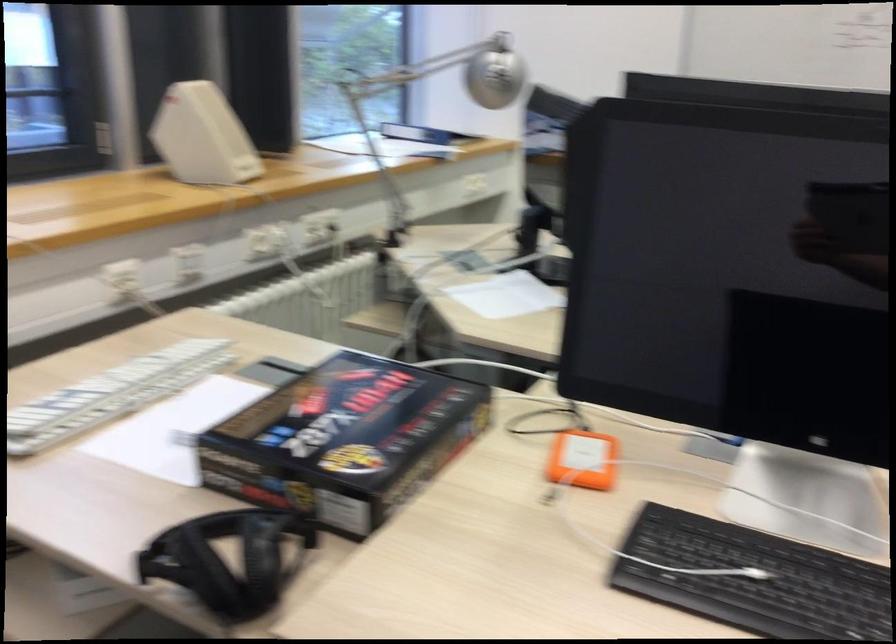
At what (x,y) coordinates should I click in order to perform the action: click on white speaker. Please return your answer as a coordinate pair (x, y). Looking at the image, I should click on (202, 136).